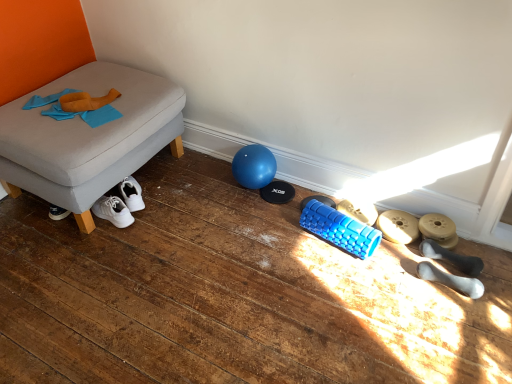
The height and width of the screenshot is (384, 512). What are the coordinates of `vacant area on top of matte gray dumbbell at lower right, which appears as the 4th footwear when viewed from the front (from a real-world perspective)` in the screenshot? It's located at (399, 225).